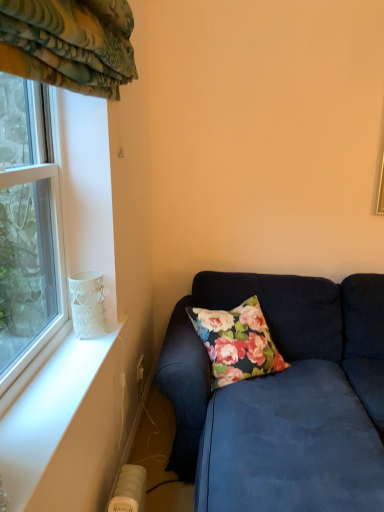
Question: Would you say velvet blue couch at lower right is to the left or to the right of white lace glass at window in the picture?

Choices:
 (A) right
 (B) left

Answer: (A)

Question: Considering their positions, is velvet blue couch at lower right located in front of or behind white lace glass at window?

Choices:
 (A) behind
 (B) front

Answer: (B)

Question: Estimate the real-world distances between objects in this image. Which object is closer to the clear glass window at left?

Choices:
 (A) white lace glass at window
 (B) velvet blue couch at lower right

Answer: (A)

Question: Which is farther from the velvet blue couch at lower right?

Choices:
 (A) clear glass window at left
 (B) white lace glass at window

Answer: (A)